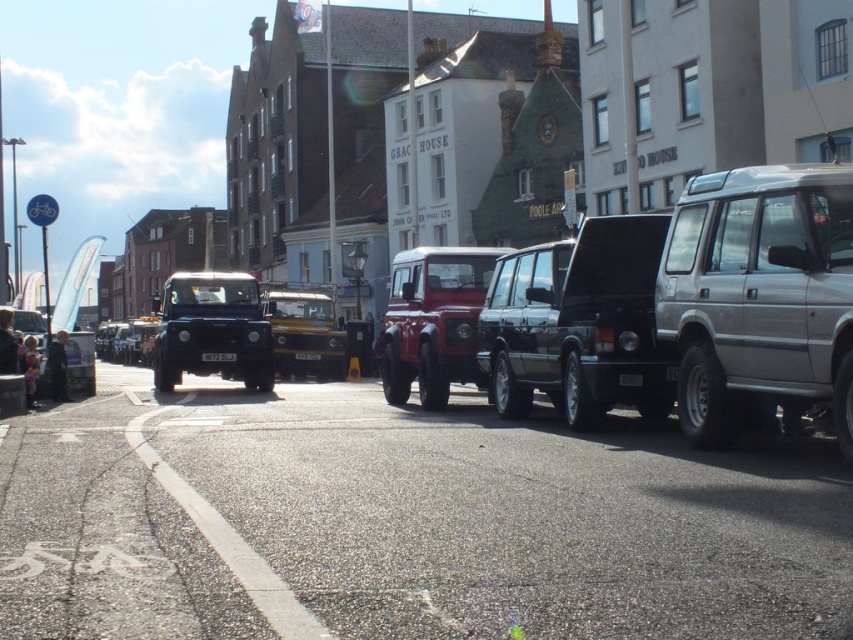
Question: Considering the relative positions of matte red suv at center and black plastic license plate at center in the image provided, where is matte red suv at center located with respect to black plastic license plate at center?

Choices:
 (A) above
 (B) below

Answer: (A)

Question: Can you confirm if silver metallic suv at right is bigger than white plastic license plate at center?

Choices:
 (A) yes
 (B) no

Answer: (A)

Question: Is silver metallic suv at right behind black plastic license plate at center?

Choices:
 (A) no
 (B) yes

Answer: (A)

Question: Estimate the real-world distances between objects in this image. Which object is farther from the silver metallic suv at right?

Choices:
 (A) black plastic license plate at center
 (B) matte red suv at center

Answer: (A)

Question: Considering the real-world distances, which object is closest to the matte red suv at center?

Choices:
 (A) matte black jeep at center
 (B) metallic yellow jeep at center

Answer: (B)

Question: Based on their relative distances, which object is farther from the matte black jeep at center?

Choices:
 (A) black plastic license plate at center
 (B) black matte suv at center
 (C) matte red suv at center
 (D) silver metallic suv at right

Answer: (D)